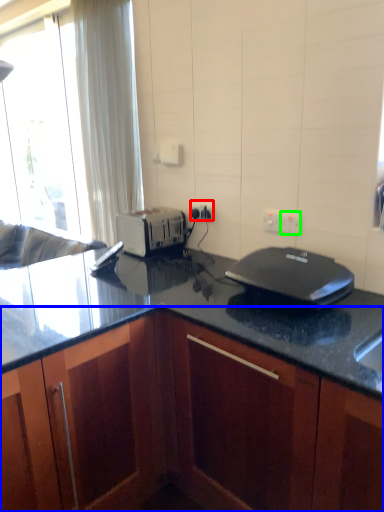
Question: Which is nearer to the electric outlet (highlighted by a red box)? cabinetry (highlighted by a blue box) or electric outlet (highlighted by a green box).

Choices:
 (A) cabinetry
 (B) electric outlet

Answer: (B)